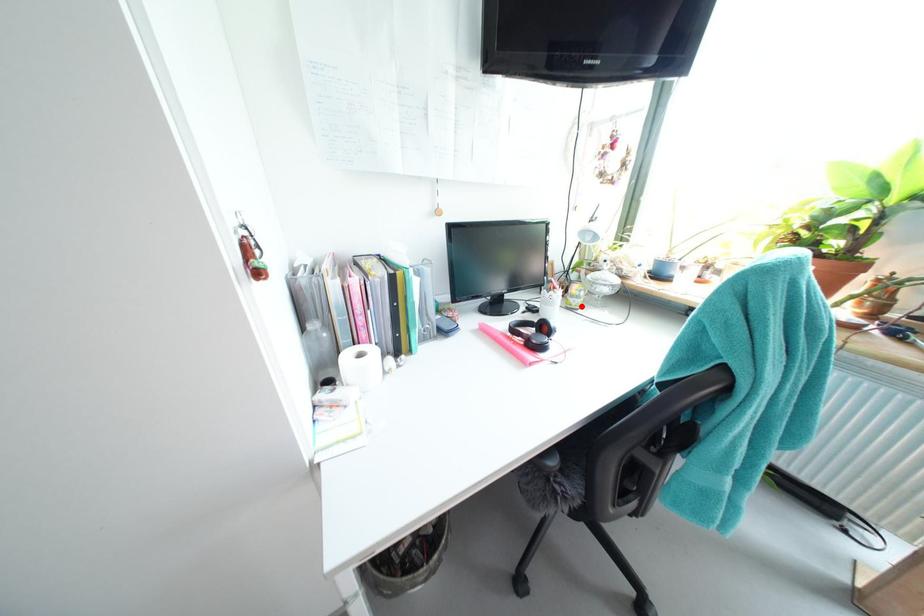
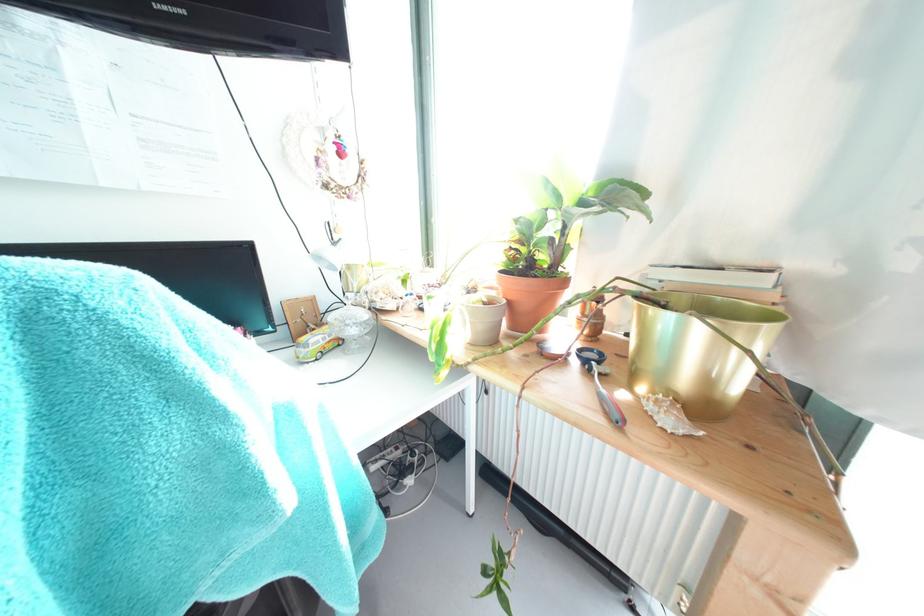
Find the pixel in the second image that matches the highlighted location in the first image.

(309, 358)